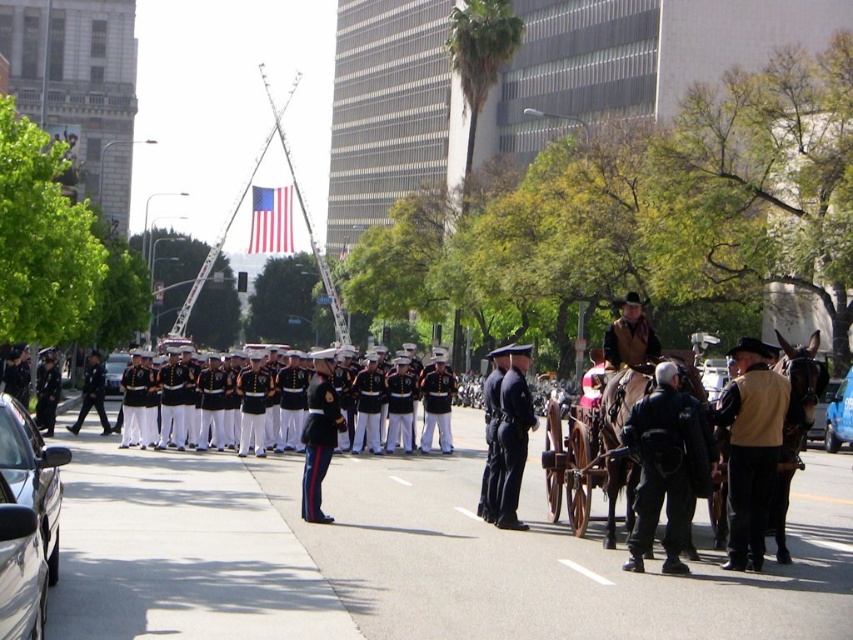
Does shiny black uniform at center appear on the right side of silver metallic sedan at center?

Indeed, shiny black uniform at center is positioned on the right side of silver metallic sedan at center.

Which is in front, point (318, 515) or point (117, 356)?

Positioned in front is point (318, 515).

What do you see at coordinates (318, 433) in the screenshot?
I see `shiny black uniform at center` at bounding box center [318, 433].

Image resolution: width=853 pixels, height=640 pixels. What are the coordinates of `shiny black uniform at center` in the screenshot? It's located at (318, 433).

Does brown leather horse at center appear under white rubber line at center?

No.

Consider the image. Can you confirm if brown leather horse at center is smaller than white rubber line at center?

Actually, brown leather horse at center might be larger than white rubber line at center.

Between point (624, 404) and point (582, 566), which one is positioned in front?

Point (582, 566) is more forward.

Locate an element on the screen. The width and height of the screenshot is (853, 640). brown leather horse at center is located at coordinates (636, 394).

Can you confirm if dark blue uniform at center is taller than shiny black uniform at center?

No.

Between dark blue uniform at center and shiny black uniform at center, which one is positioned higher?

dark blue uniform at center is above.

Does point (512, 452) lie behind point (305, 477)?

No, it is in front of (305, 477).

This screenshot has width=853, height=640. I want to click on dark blue uniform at center, so click(x=514, y=435).